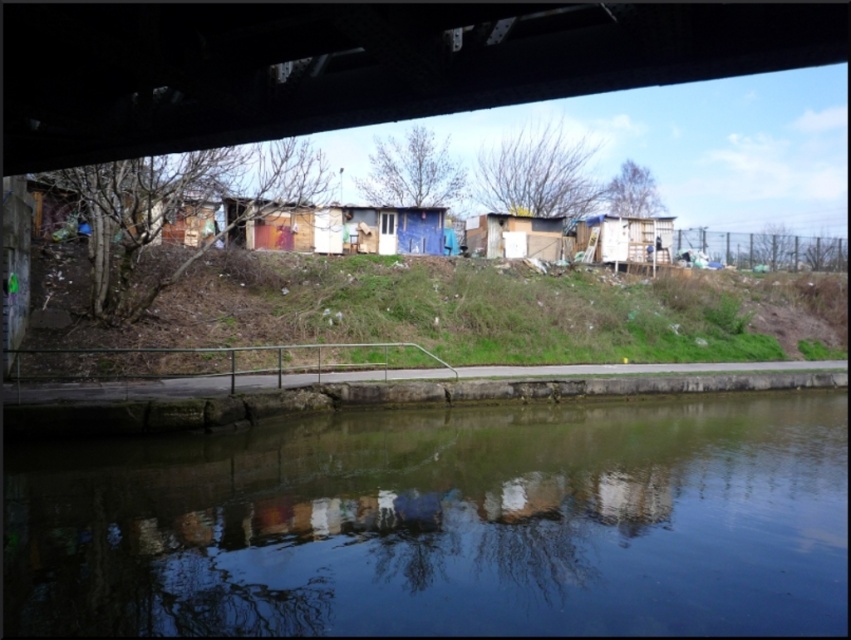
You are standing under the dark gray concrete bridge at upper center and want to walk towards the wooden shack at center. Which direction should you head?

You should head to the right, since the dark gray concrete bridge at upper center is to the left of the wooden shack at center.

You are standing on the grassy embankment near the dark gray concrete bridge at upper center. You want to walk straight ahead towards the settlement. Will you be walking uphill or downhill?

The grassy embankment where the settlement is situated is uneven and covered with patches of grass and scattered debris, indicating neglect or lack of maintenance. Since the settlement is beside a canal and on an embankment, it is likely that walking towards the settlement from the bridge would involve going downhill towards the water level, but the description does not explicitly state the slope direction. However, based on typical canal embankment structures, the ground might slope downwards towards the 1